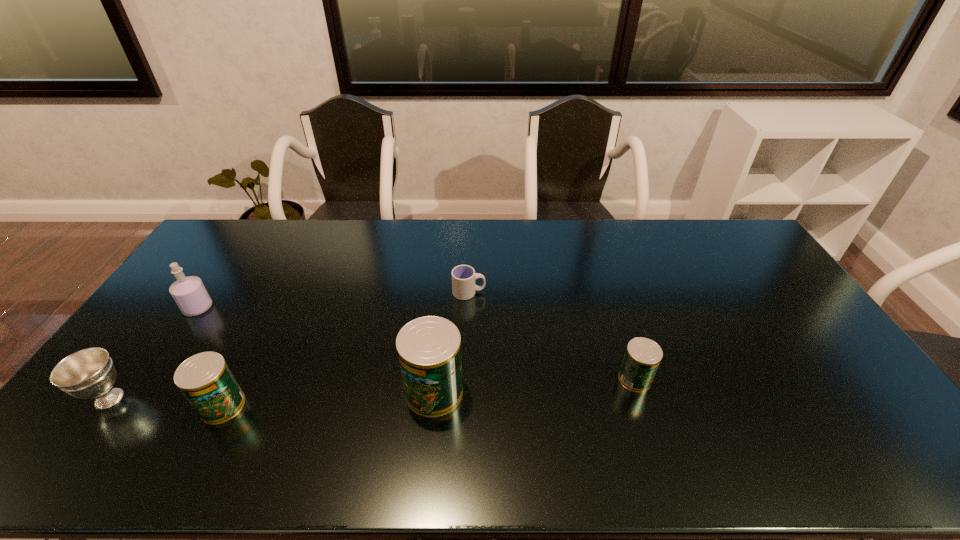
This screenshot has width=960, height=540. In order to click on the third object from left to right in this screenshot , I will do `click(206, 381)`.

Image resolution: width=960 pixels, height=540 pixels. In order to click on the leftmost can in this screenshot , I will do `click(206, 381)`.

Find the location of a particular element. Image resolution: width=960 pixels, height=540 pixels. the second can from left to right is located at coordinates (429, 348).

You are a GUI agent. You are given a task and a screenshot of the screen. Output one action in this format:
    pyautogui.click(x=<x>, y=<y>)
    Task: Click on the rightmost object
    
    Given the screenshot: What is the action you would take?
    (x=642, y=357)

I want to click on the rightmost can, so click(642, 357).

Where is `the fifth shortest object`? the fifth shortest object is located at coordinates (189, 293).

Where is `cup`? cup is located at coordinates (463, 276).

You are a GUI agent. You are given a task and a screenshot of the screen. Output one action in this format:
    pyautogui.click(x=<x>, y=<y>)
    Task: Click on the chalice
    Image resolution: width=960 pixels, height=540 pixels.
    Given the screenshot: What is the action you would take?
    pyautogui.click(x=89, y=373)

The width and height of the screenshot is (960, 540). I want to click on vacant space located 0.310m on the right of the second tallest can, so click(363, 406).

I want to click on vacant point located on the back of the second can from left to right, so point(438,349).